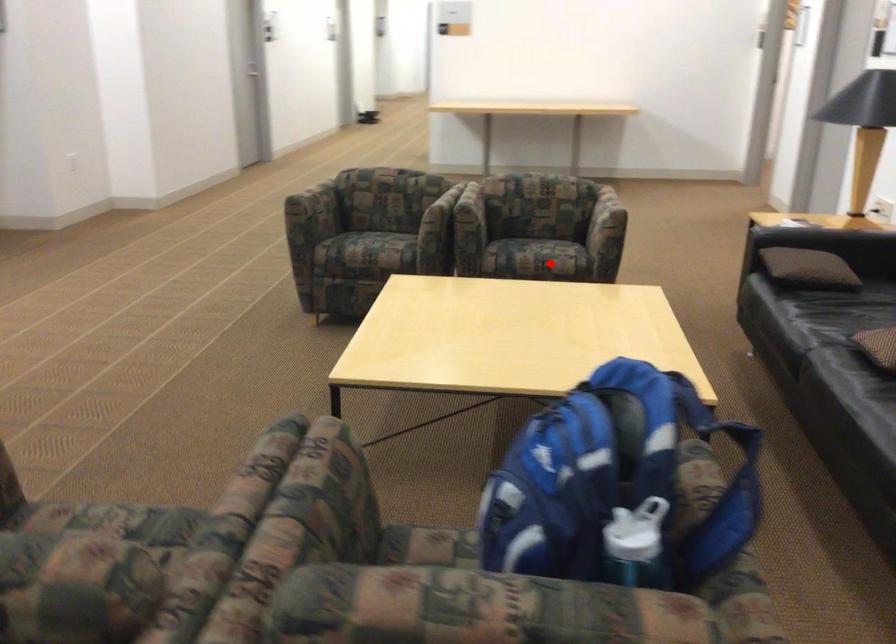
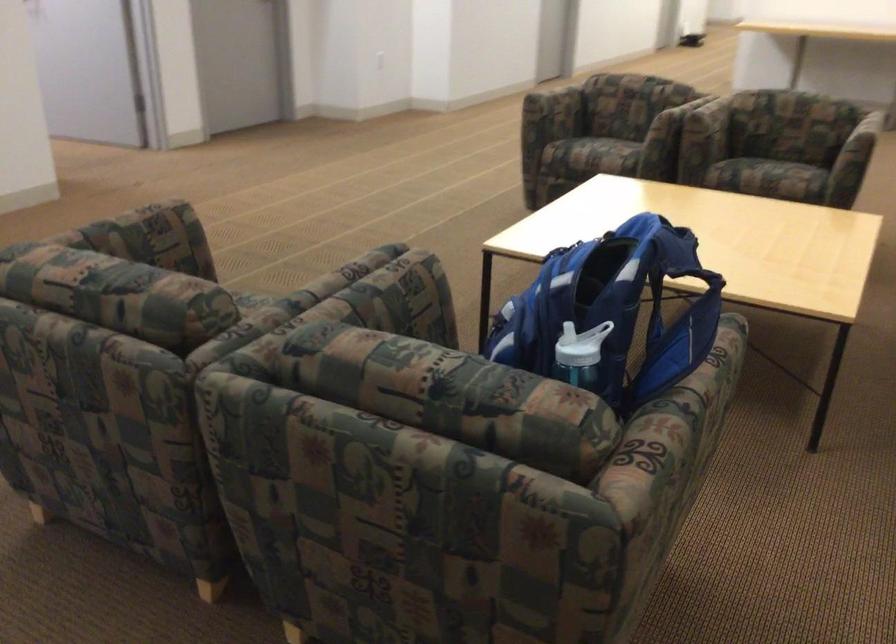
Find the pixel in the second image that matches the highlighted location in the first image.

(769, 178)